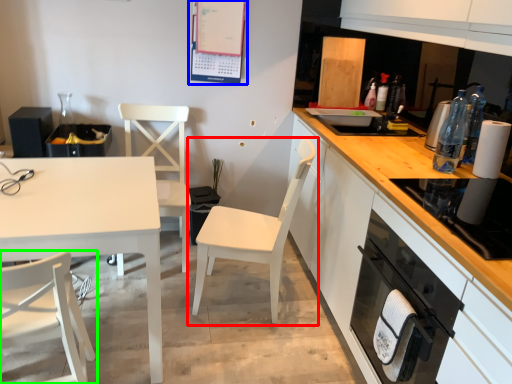
Question: Which object is positioned farthest from chair (highlighted by a red box)? Select from bulletin board (highlighted by a blue box) and chair (highlighted by a green box).

Choices:
 (A) bulletin board
 (B) chair

Answer: (A)